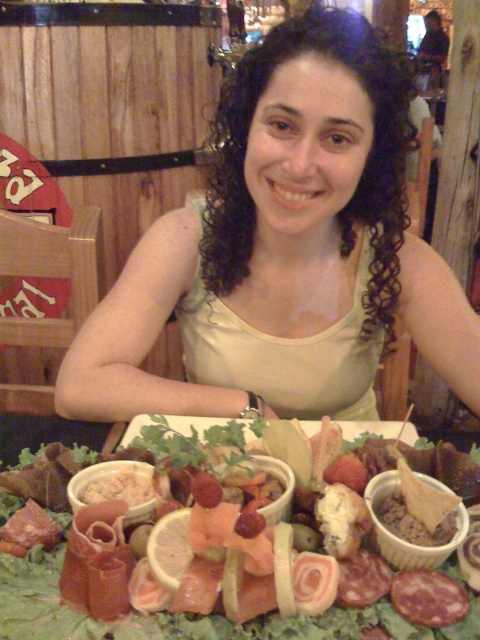
Which of these two, green fabric tank top at center or matte white cheese at center, stands shorter?

Standing shorter between the two is matte white cheese at center.

Between green fabric tank top at center and matte white cheese at center, which one is positioned lower?

matte white cheese at center is below.

Which is in front, point (384, 86) or point (188, 632)?

Positioned in front is point (188, 632).

Locate an element on the screen. This screenshot has width=480, height=640. green fabric tank top at center is located at coordinates (282, 236).